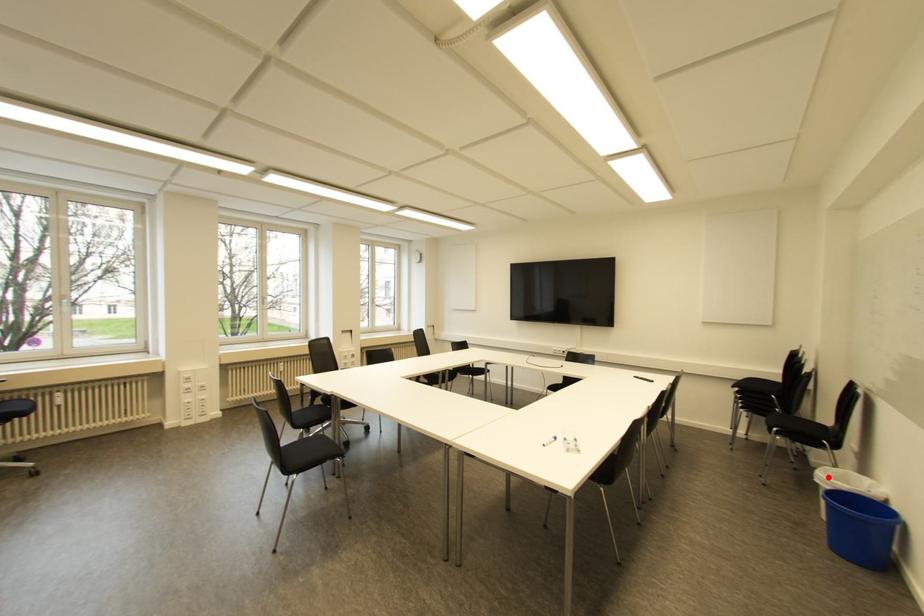
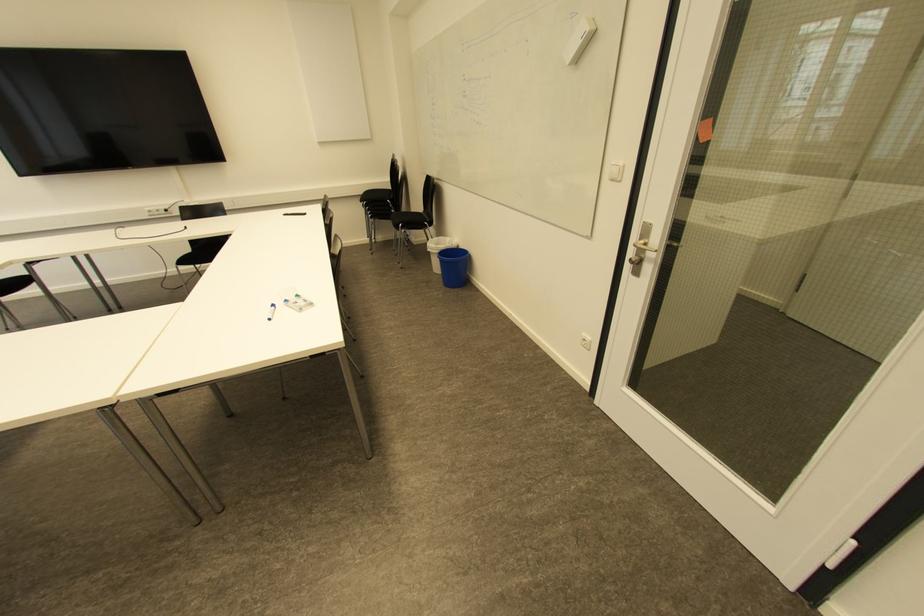
Locate, in the second image, the point that corresponds to the highlighted location in the first image.

(434, 245)